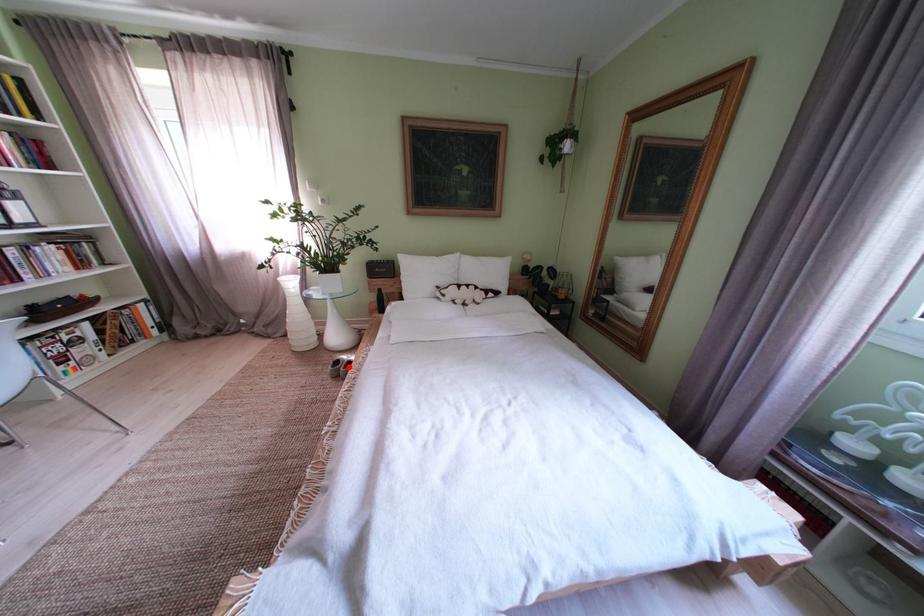
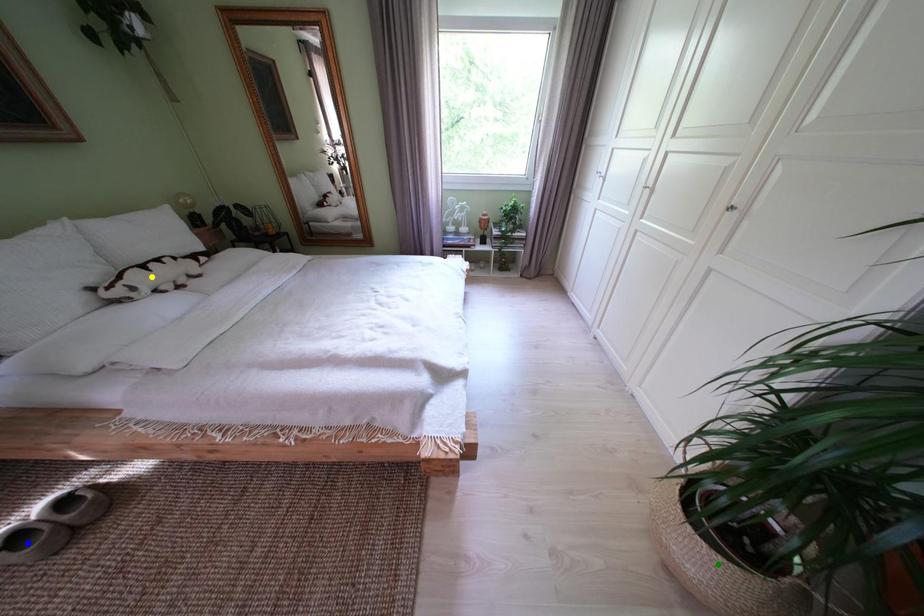
Question: I am providing you with two images of the same scene from different viewpoints. A red point is marked on the first image. You are given multiple points on the second image. Which point in image 2 is actually the same real-world point as the red point in image 1?

Choices:
 (A) yellow point
 (B) green point
 (C) blue point

Answer: (C)